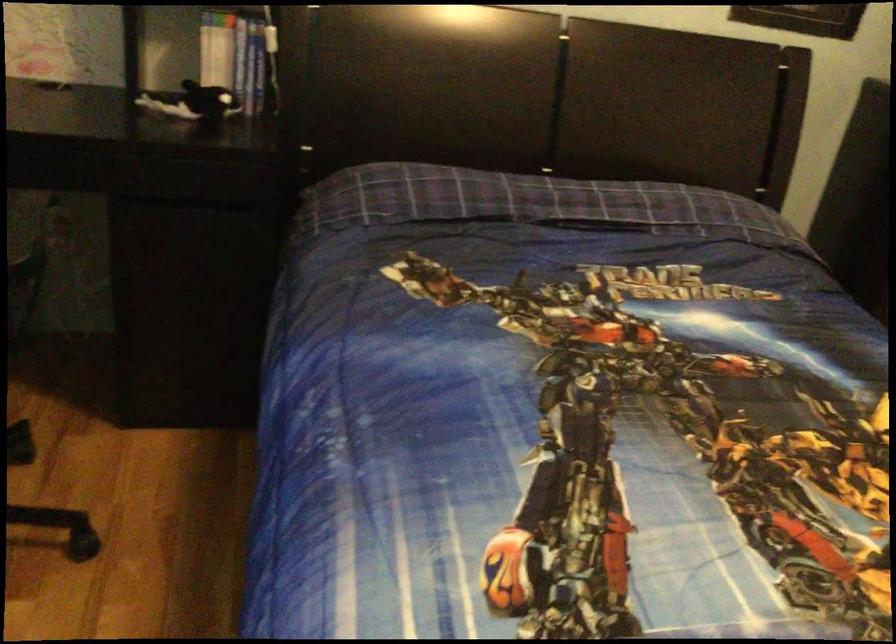
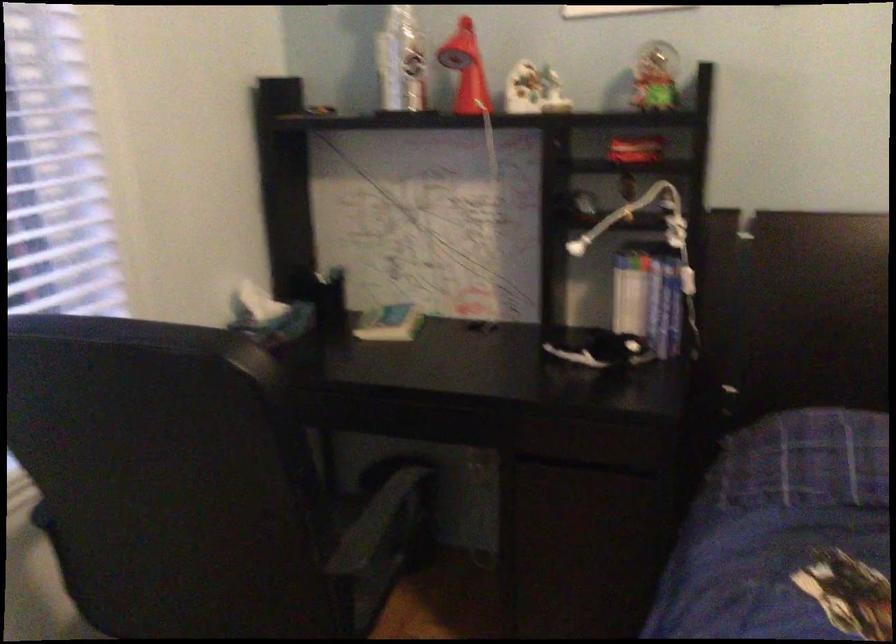
Locate, in the second image, the point that corresponds to point (253, 69) in the first image.

(664, 307)